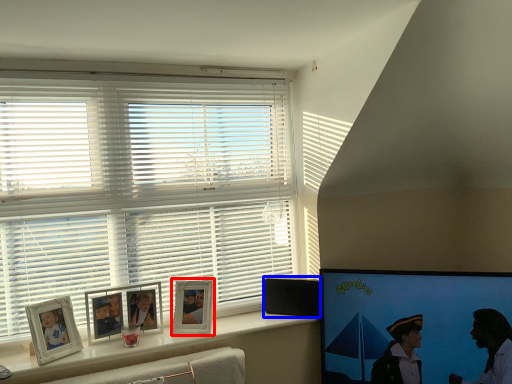
Question: Among these objects, which one is nearest to the camera, picture frame (highlighted by a red box) or speaker (highlighted by a blue box)?

Choices:
 (A) picture frame
 (B) speaker

Answer: (A)